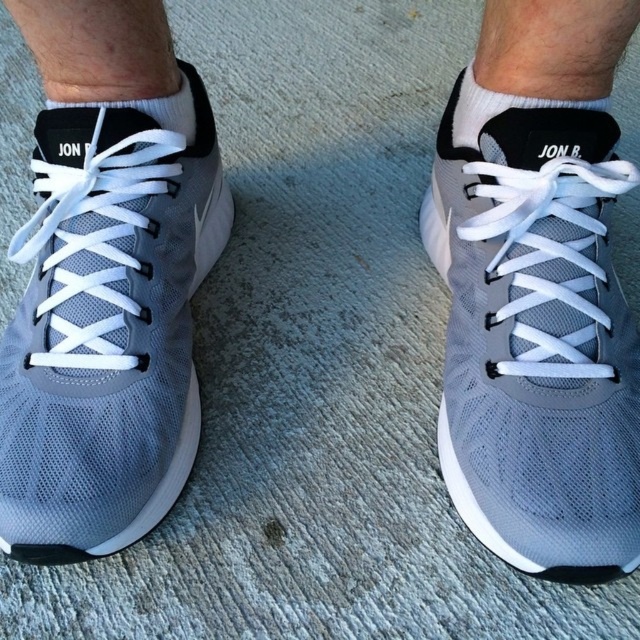
Who is shorter, matte gray shoe at center or white cotton sock at upper center?

With less height is white cotton sock at upper center.

Is point (579, 262) positioned before point (556, 100)?

That is False.

Does point (552, 483) lie in front of point (458, 138)?

That is True.

The height and width of the screenshot is (640, 640). I want to click on matte gray shoe at center, so click(x=536, y=340).

Is matte gray shoe at center to the left of matte gray sneaker at left from the viewer's perspective?

No, matte gray shoe at center is not to the left of matte gray sneaker at left.

What do you see at coordinates (536, 340) in the screenshot? The width and height of the screenshot is (640, 640). I see `matte gray shoe at center` at bounding box center [536, 340].

Is point (490, 330) farther from camera compared to point (177, 419)?

No, it is in front of (177, 419).

Find the location of a particular element. matte gray shoe at center is located at coordinates (536, 340).

Which is more to the left, matte gray shoe at center or white cotton sock at center?

white cotton sock at center is more to the left.

Who is taller, matte gray shoe at center or white cotton sock at center?

With more height is matte gray shoe at center.

Who is more forward, (476, 492) or (166, 108)?

Positioned in front is point (476, 492).

Where is `matte gray shoe at center`? This screenshot has width=640, height=640. matte gray shoe at center is located at coordinates (536, 340).